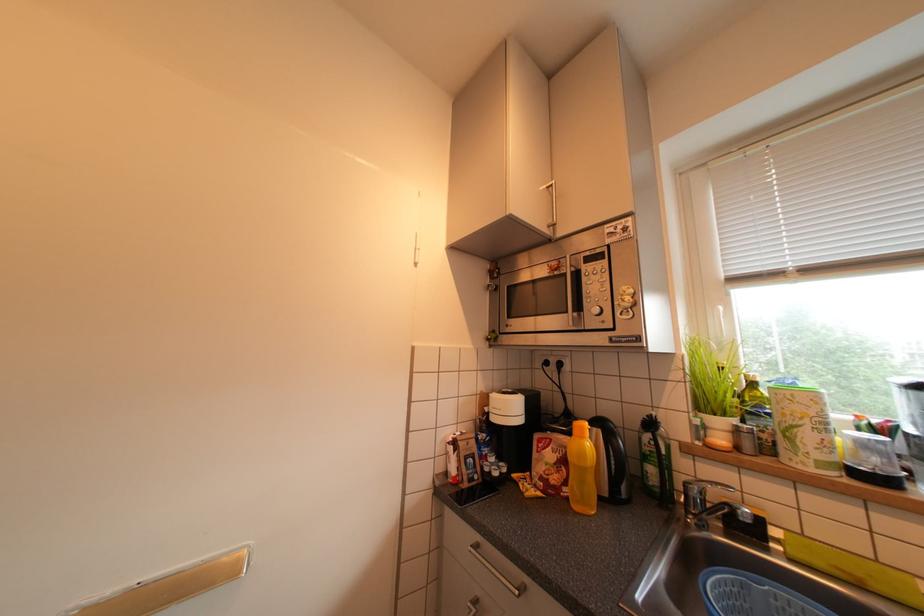
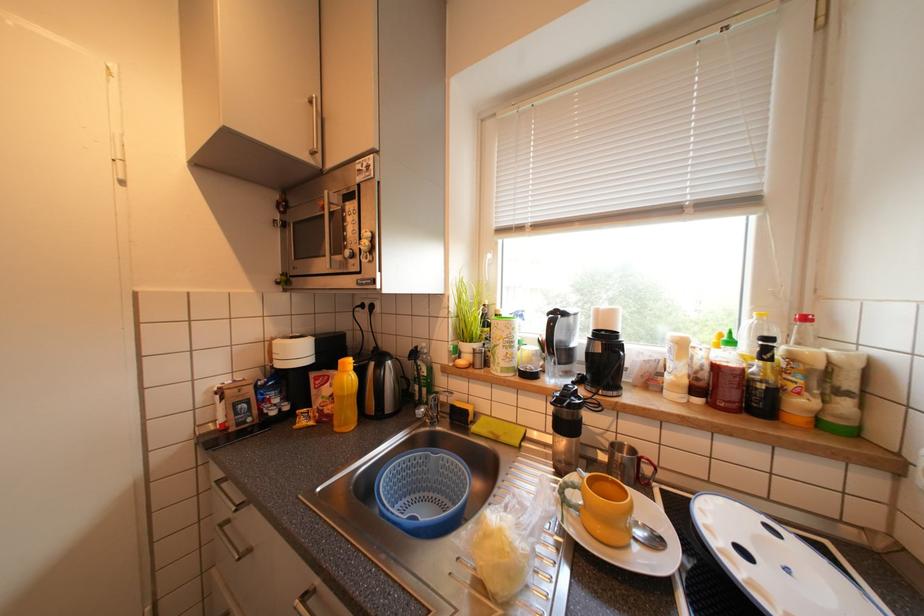
Question: The images are taken continuously from a first-person perspective. In which direction is your viewpoint rotating?

Choices:
 (A) Left
 (B) Right
 (C) Up
 (D) Down

Answer: (B)